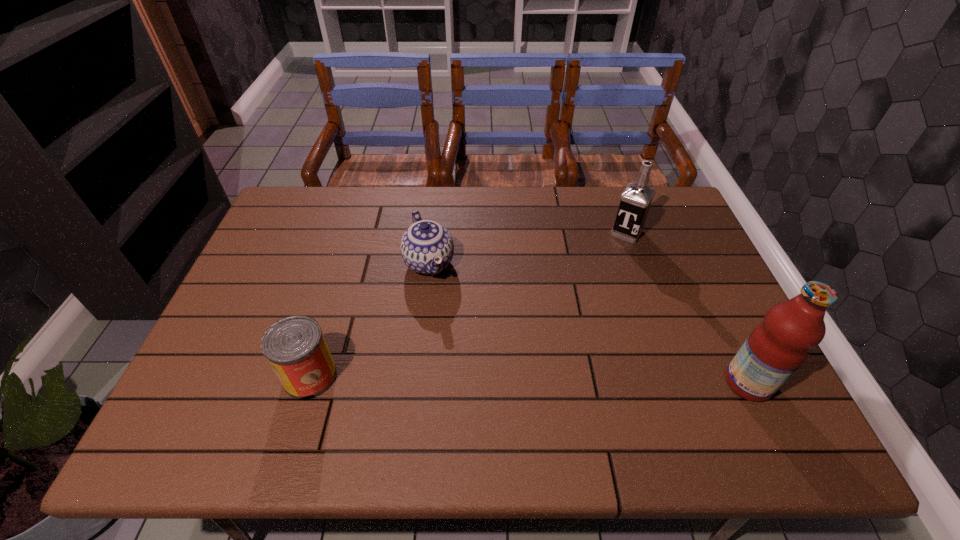
The width and height of the screenshot is (960, 540). Find the location of `vacant space on the desktop that is between the leftmost object and the fruit juice and is positioned on the front label of the second object from right to left`. vacant space on the desktop that is between the leftmost object and the fruit juice and is positioned on the front label of the second object from right to left is located at coordinates (535, 380).

At what (x,y) coordinates should I click in order to perform the action: click on vacant space on the desktop that is between the leftmost object and the tallest object and is positioned at the spout of the second object from left to right. Please return your answer as a coordinate pair (x, y). The width and height of the screenshot is (960, 540). Looking at the image, I should click on (480, 379).